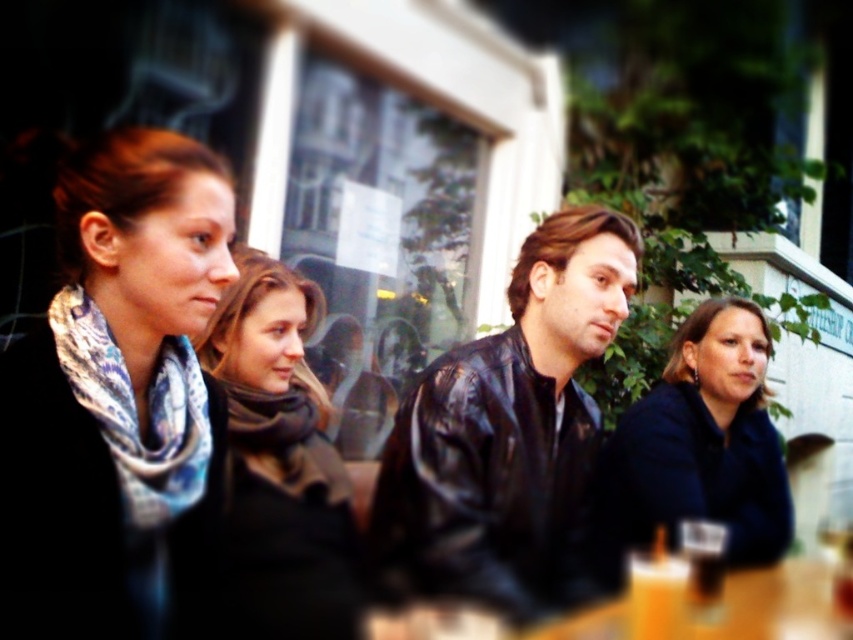
Question: Does printed scarf at left lie in front of orange liquid at lower right?

Choices:
 (A) yes
 (B) no

Answer: (A)

Question: Which point is closer to the camera taking this photo?

Choices:
 (A) (664, 621)
 (B) (149, 483)
 (C) (277, 518)

Answer: (B)

Question: Which point is farther to the camera?

Choices:
 (A) dark gray wool scarf at center
 (B) black leather jacket at center
 (C) dark blue jacket at center

Answer: (C)

Question: Among these points, which one is nearest to the camera?

Choices:
 (A) (229, 403)
 (B) (628, 621)

Answer: (B)

Question: Is the position of printed scarf at left more distant than that of printed silk scarf at left?

Choices:
 (A) yes
 (B) no

Answer: (B)

Question: Can you confirm if matte brown scarf at center is smaller than dark blue jacket at center?

Choices:
 (A) no
 (B) yes

Answer: (B)